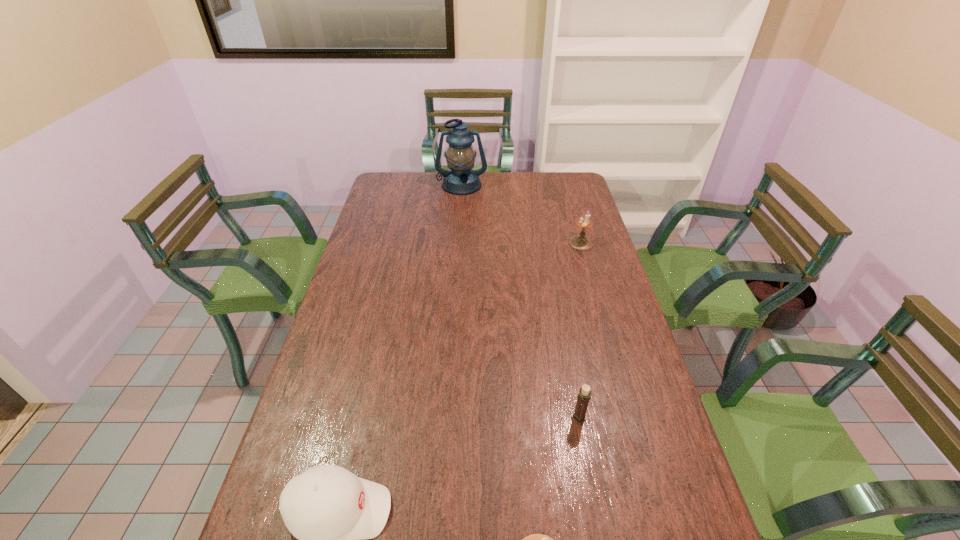
The image size is (960, 540). What are the coordinates of `object that is at the right edge` in the screenshot? It's located at (579, 242).

This screenshot has height=540, width=960. What are the coordinates of `free location at the far edge of the desktop` in the screenshot? It's located at (533, 179).

The height and width of the screenshot is (540, 960). Identify the location of free space at the right edge. (612, 362).

Identify the location of vacant space at the far right corner of the desktop. The height and width of the screenshot is (540, 960). (573, 190).

You are a GUI agent. You are given a task and a screenshot of the screen. Output one action in this format:
    pyautogui.click(x=<x>, y=<y>)
    Task: Click on the vacant area that lies between the second candle holder from left to right and the farthest object
    The height and width of the screenshot is (540, 960).
    Given the screenshot: What is the action you would take?
    coord(520,301)

Identify the location of vacant region between the farthest object and the farthest candle holder. (521, 214).

Select which object is the closest to the third object from left to right. Please provide its 2D coordinates. Your answer should be formatted as a tuple, i.e. [(x, y)], where the tuple contains the x and y coordinates of a point satisfying the conditions above.

[(330, 511)]

Identify which object is located as the nearest to the tallest object. Please provide its 2D coordinates. Your answer should be formatted as a tuple, i.e. [(x, y)], where the tuple contains the x and y coordinates of a point satisfying the conditions above.

[(579, 242)]

I want to click on the second closest candle holder to the third object from right to left, so click(x=579, y=242).

Identify which candle holder is located as the third nearest to the tallest object. Please provide its 2D coordinates. Your answer should be formatted as a tuple, i.e. [(x, y)], where the tuple contains the x and y coordinates of a point satisfying the conditions above.

[(536, 539)]